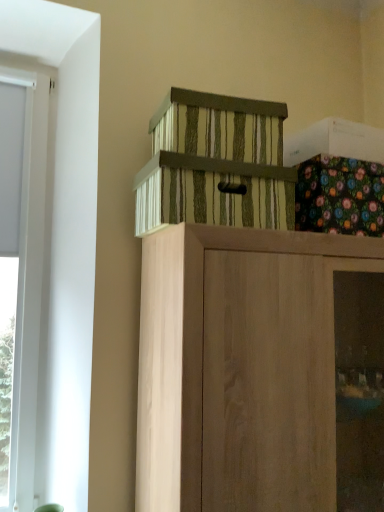
Question: From a real-world perspective, does wooden cabinet at center, which ranks as the second cabinetry in top-to-bottom order, stand above striped cardboard box at upper center, arranged as the first cabinetry when viewed from the top?

Choices:
 (A) yes
 (B) no

Answer: (B)

Question: Would you say wooden cabinet at center, positioned as the 1th cabinetry in bottom-to-top order, contains striped cardboard box at upper center, arranged as the first cabinetry when viewed from the top?

Choices:
 (A) yes
 (B) no

Answer: (B)

Question: From the image's perspective, would you say wooden cabinet at center, which ranks as the second cabinetry in top-to-bottom order, is positioned over striped cardboard box at upper center, arranged as the first cabinetry when viewed from the top?

Choices:
 (A) no
 (B) yes

Answer: (A)

Question: Considering the relative sizes of wooden cabinet at center, positioned as the 1th cabinetry in bottom-to-top order, and striped cardboard box at upper center, positioned as the 2th cabinetry in bottom-to-top order, in the image provided, is wooden cabinet at center, positioned as the 1th cabinetry in bottom-to-top order, taller than striped cardboard box at upper center, positioned as the 2th cabinetry in bottom-to-top order,?

Choices:
 (A) no
 (B) yes

Answer: (B)

Question: Is wooden cabinet at center, which ranks as the second cabinetry in top-to-bottom order, positioned with its back to striped cardboard box at upper center, positioned as the 2th cabinetry in bottom-to-top order?

Choices:
 (A) no
 (B) yes

Answer: (A)

Question: Is striped cardboard box at upper center, positioned as the 2th cabinetry in bottom-to-top order, bigger or smaller than wooden cabinet at center, positioned as the 1th cabinetry in bottom-to-top order?

Choices:
 (A) big
 (B) small

Answer: (B)

Question: In the image, is striped cardboard box at upper center, positioned as the 2th cabinetry in bottom-to-top order, positioned in front of or behind wooden cabinet at center, which ranks as the second cabinetry in top-to-bottom order?

Choices:
 (A) front
 (B) behind

Answer: (B)

Question: From a real-world perspective, is striped cardboard box at upper center, arranged as the first cabinetry when viewed from the top, positioned above or below wooden cabinet at center, positioned as the 1th cabinetry in bottom-to-top order?

Choices:
 (A) below
 (B) above

Answer: (B)

Question: From the image's perspective, is striped cardboard box at upper center, arranged as the first cabinetry when viewed from the top, positioned above or below wooden cabinet at center, which ranks as the second cabinetry in top-to-bottom order?

Choices:
 (A) below
 (B) above

Answer: (B)

Question: From their relative heights in the image, would you say floral fabric box at upper right is taller or shorter than striped cardboard box at upper center, positioned as the 2th cabinetry in bottom-to-top order?

Choices:
 (A) tall
 (B) short

Answer: (A)

Question: Considering the relative positions of floral fabric box at upper right and striped cardboard box at upper center, arranged as the first cabinetry when viewed from the top, in the image provided, is floral fabric box at upper right to the left or to the right of striped cardboard box at upper center, arranged as the first cabinetry when viewed from the top,?

Choices:
 (A) left
 (B) right

Answer: (B)

Question: Is point tap(297, 223) positioned closer to the camera than point tap(195, 193)?

Choices:
 (A) closer
 (B) farther

Answer: (B)

Question: Is floral fabric box at upper right in front of or behind striped cardboard box at upper center, arranged as the first cabinetry when viewed from the top, in the image?

Choices:
 (A) front
 (B) behind

Answer: (B)

Question: Considering their positions, is wooden cabinet at center, positioned as the 1th cabinetry in bottom-to-top order, located in front of or behind floral fabric box at upper right?

Choices:
 (A) behind
 (B) front

Answer: (B)

Question: Would you say wooden cabinet at center, positioned as the 1th cabinetry in bottom-to-top order, is inside or outside floral fabric box at upper right?

Choices:
 (A) outside
 (B) inside

Answer: (A)